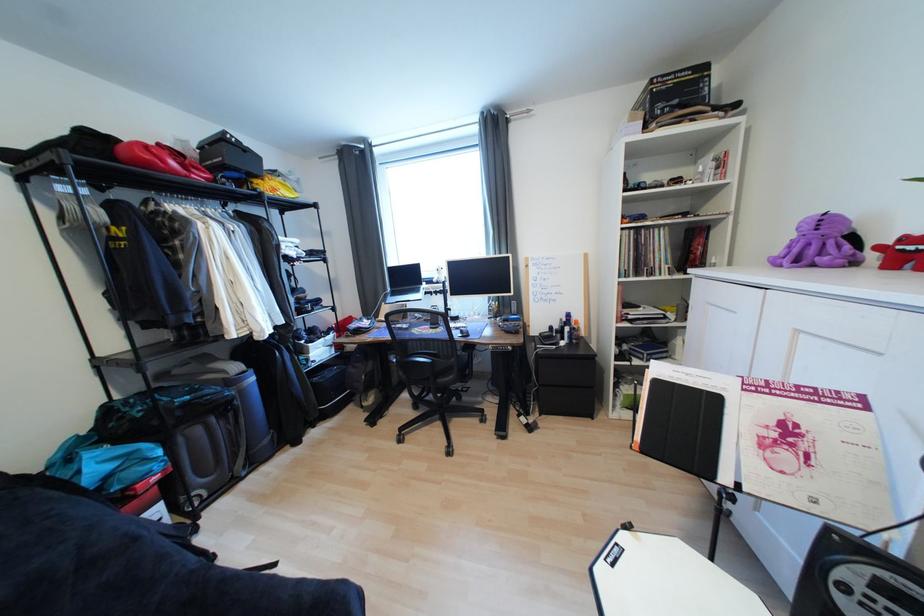
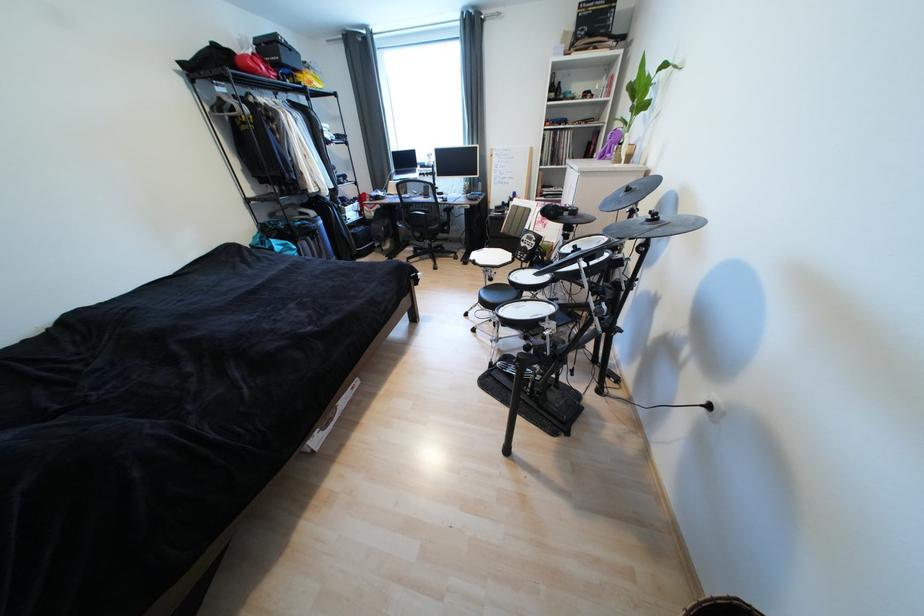
Find the pixel in the second image that matches [152,166] in the first image.

(261, 73)